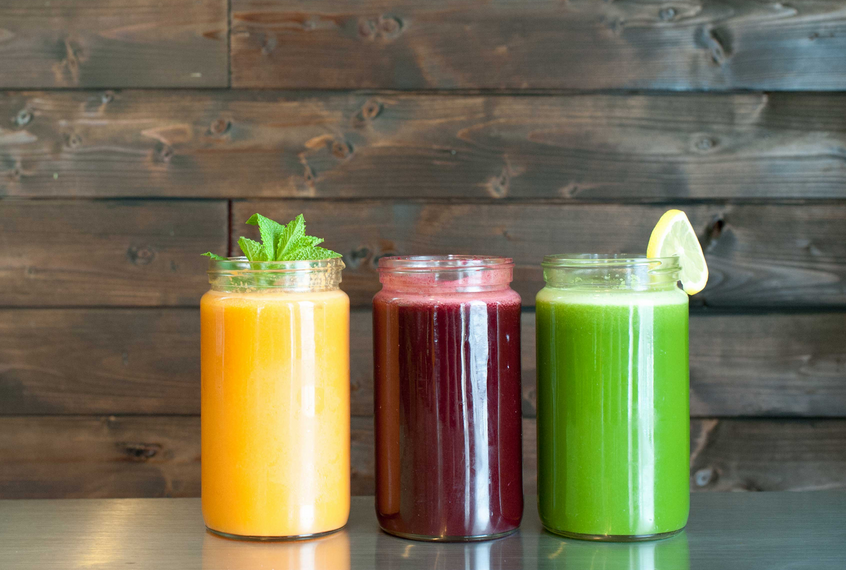
At what (x,y) coordinates should I click in order to perform the action: click on glass. Please return your answer as a coordinate pair (x, y). The height and width of the screenshot is (570, 846). Looking at the image, I should click on click(x=635, y=390), click(x=463, y=359), click(x=275, y=382).